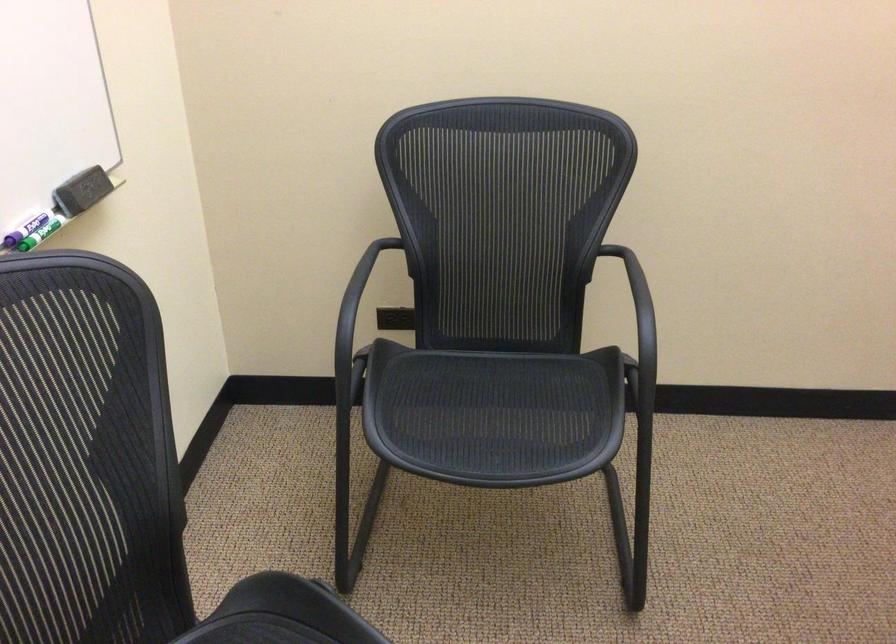
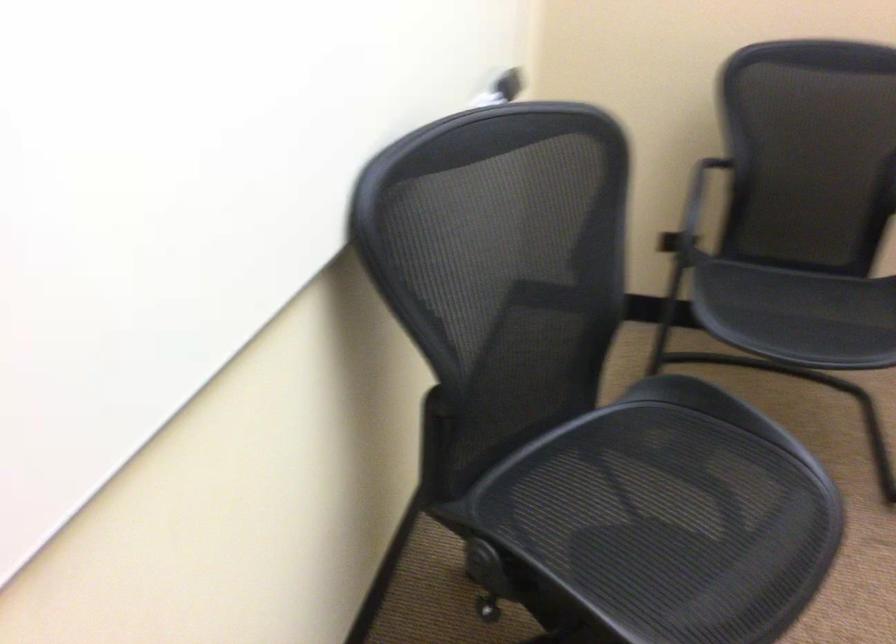
Question: The camera is either moving clockwise (left) or counter-clockwise (right) around the object. The first image is from the beginning of the video and the second image is from the end. Is the camera moving left or right when shooting the video?

Choices:
 (A) Left
 (B) Right

Answer: (B)